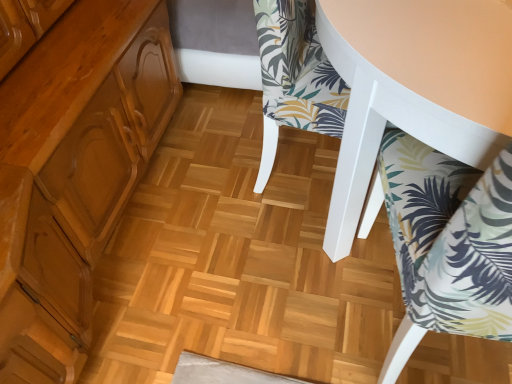
What is the approximate width of white fabric chair at upper right, which is counted as the second chair, starting from the bottom?

22.88 inches.

This screenshot has width=512, height=384. Identify the location of white fabric chair at upper right, the 1th chair viewed from the top. (415, 87).

In order to face white fabric chair at upper right, the 1th chair viewed from the top, should I rotate leftwards or rightwards?

Rotate your view right by about 12.801°.

Describe the element at coordinates (415, 87) in the screenshot. The height and width of the screenshot is (384, 512). I see `white fabric chair at upper right, the 1th chair viewed from the top` at that location.

The width and height of the screenshot is (512, 384). Describe the element at coordinates (450, 237) in the screenshot. I see `printed fabric chair at lower right, which ranks as the 1th chair in bottom-to-top order` at that location.

You are a GUI agent. You are given a task and a screenshot of the screen. Output one action in this format:
    pyautogui.click(x=<x>, y=<y>)
    Task: Click on the printed fabric chair at lower right, which ranks as the 1th chair in bottom-to-top order
    This screenshot has height=384, width=512.
    Given the screenshot: What is the action you would take?
    pyautogui.click(x=450, y=237)

Identify the location of white fabric chair at upper right, the 1th chair viewed from the top. (415, 87).

Based on their positions, is white fabric chair at upper right, the 1th chair viewed from the top, located to the left or right of printed fabric chair at lower right, which appears as the 2th chair when viewed from the top?

Based on their positions, white fabric chair at upper right, the 1th chair viewed from the top, is located to the left of printed fabric chair at lower right, which appears as the 2th chair when viewed from the top.

Is white fabric chair at upper right, which is counted as the second chair, starting from the bottom, further to camera compared to printed fabric chair at lower right, which ranks as the 1th chair in bottom-to-top order?

Yes.

Between point (387, 18) and point (452, 297), which one is positioned in front?

Positioned in front is point (452, 297).

From the image's perspective, which object appears higher, white fabric chair at upper right, the 1th chair viewed from the top, or printed fabric chair at lower right, which appears as the 2th chair when viewed from the top?

white fabric chair at upper right, the 1th chair viewed from the top.

From a real-world perspective, does white fabric chair at upper right, the 1th chair viewed from the top, sit lower than printed fabric chair at lower right, which ranks as the 1th chair in bottom-to-top order?

Yes, from a real-world perspective, white fabric chair at upper right, the 1th chair viewed from the top, is below printed fabric chair at lower right, which ranks as the 1th chair in bottom-to-top order.

Considering the relative sizes of white fabric chair at upper right, the 1th chair viewed from the top, and printed fabric chair at lower right, which appears as the 2th chair when viewed from the top, in the image provided, is white fabric chair at upper right, the 1th chair viewed from the top, thinner than printed fabric chair at lower right, which appears as the 2th chair when viewed from the top,?

No, white fabric chair at upper right, the 1th chair viewed from the top, is not thinner than printed fabric chair at lower right, which appears as the 2th chair when viewed from the top.

Considering the sizes of objects white fabric chair at upper right, the 1th chair viewed from the top, and printed fabric chair at lower right, which ranks as the 1th chair in bottom-to-top order, in the image provided, who is shorter, white fabric chair at upper right, the 1th chair viewed from the top, or printed fabric chair at lower right, which ranks as the 1th chair in bottom-to-top order,?

white fabric chair at upper right, the 1th chair viewed from the top.

Who is smaller, white fabric chair at upper right, which is counted as the second chair, starting from the bottom, or printed fabric chair at lower right, which appears as the 2th chair when viewed from the top?

printed fabric chair at lower right, which appears as the 2th chair when viewed from the top, is smaller.

From the picture: Is white fabric chair at upper right, the 1th chair viewed from the top, inside the boundaries of printed fabric chair at lower right, which ranks as the 1th chair in bottom-to-top order, or outside?

white fabric chair at upper right, the 1th chair viewed from the top, lies outside printed fabric chair at lower right, which ranks as the 1th chair in bottom-to-top order.

Is there a large distance between white fabric chair at upper right, which is counted as the second chair, starting from the bottom, and printed fabric chair at lower right, which appears as the 2th chair when viewed from the top?

No, white fabric chair at upper right, which is counted as the second chair, starting from the bottom, is not far from printed fabric chair at lower right, which appears as the 2th chair when viewed from the top.

Is white fabric chair at upper right, the 1th chair viewed from the top, facing towards printed fabric chair at lower right, which appears as the 2th chair when viewed from the top?

No, white fabric chair at upper right, the 1th chair viewed from the top, is not aimed at printed fabric chair at lower right, which appears as the 2th chair when viewed from the top.

What's the angular difference between white fabric chair at upper right, which is counted as the second chair, starting from the bottom, and printed fabric chair at lower right, which ranks as the 1th chair in bottom-to-top order,'s facing directions?

The facing directions of white fabric chair at upper right, which is counted as the second chair, starting from the bottom, and printed fabric chair at lower right, which ranks as the 1th chair in bottom-to-top order, are 101 degrees apart.

You are a GUI agent. You are given a task and a screenshot of the screen. Output one action in this format:
    pyautogui.click(x=<x>, y=<y>)
    Task: Click on the chair above the printed fabric chair at lower right, which appears as the 2th chair when viewed from the top (from the image's perspective)
    
    Given the screenshot: What is the action you would take?
    pyautogui.click(x=415, y=87)

In the image, is printed fabric chair at lower right, which appears as the 2th chair when viewed from the top, on the left side or the right side of white fabric chair at upper right, the 1th chair viewed from the top?

Based on their positions, printed fabric chair at lower right, which appears as the 2th chair when viewed from the top, is located to the right of white fabric chair at upper right, the 1th chair viewed from the top.

In the image, is printed fabric chair at lower right, which ranks as the 1th chair in bottom-to-top order, positioned in front of or behind white fabric chair at upper right, which is counted as the second chair, starting from the bottom?

In the image, printed fabric chair at lower right, which ranks as the 1th chair in bottom-to-top order, appears in front of white fabric chair at upper right, which is counted as the second chair, starting from the bottom.

Which is nearer, [490,219] or [375,148]?

Clearly, point [490,219] is closer to the camera than point [375,148].

From the image's perspective, which one is positioned lower, printed fabric chair at lower right, which appears as the 2th chair when viewed from the top, or white fabric chair at upper right, the 1th chair viewed from the top?

printed fabric chair at lower right, which appears as the 2th chair when viewed from the top, is shown below in the image.

From a real-world perspective, is printed fabric chair at lower right, which ranks as the 1th chair in bottom-to-top order, on top of white fabric chair at upper right, the 1th chair viewed from the top?

Yes.

Can you confirm if printed fabric chair at lower right, which ranks as the 1th chair in bottom-to-top order, is wider than white fabric chair at upper right, which is counted as the second chair, starting from the bottom?

No, printed fabric chair at lower right, which ranks as the 1th chair in bottom-to-top order, is not wider than white fabric chair at upper right, which is counted as the second chair, starting from the bottom.

Considering the sizes of objects printed fabric chair at lower right, which ranks as the 1th chair in bottom-to-top order, and white fabric chair at upper right, which is counted as the second chair, starting from the bottom, in the image provided, who is taller, printed fabric chair at lower right, which ranks as the 1th chair in bottom-to-top order, or white fabric chair at upper right, which is counted as the second chair, starting from the bottom,?

Standing taller between the two is printed fabric chair at lower right, which ranks as the 1th chair in bottom-to-top order.

Which of these two, printed fabric chair at lower right, which appears as the 2th chair when viewed from the top, or white fabric chair at upper right, the 1th chair viewed from the top, is bigger?

white fabric chair at upper right, the 1th chair viewed from the top.

Can we say printed fabric chair at lower right, which ranks as the 1th chair in bottom-to-top order, lies outside white fabric chair at upper right, which is counted as the second chair, starting from the bottom?

That's correct, printed fabric chair at lower right, which ranks as the 1th chair in bottom-to-top order, is outside of white fabric chair at upper right, which is counted as the second chair, starting from the bottom.

Is printed fabric chair at lower right, which appears as the 2th chair when viewed from the top, in contact with white fabric chair at upper right, the 1th chair viewed from the top?

No, printed fabric chair at lower right, which appears as the 2th chair when viewed from the top, is not in contact with white fabric chair at upper right, the 1th chair viewed from the top.

Could you tell me if printed fabric chair at lower right, which appears as the 2th chair when viewed from the top, is facing white fabric chair at upper right, which is counted as the second chair, starting from the bottom?

Yes, printed fabric chair at lower right, which appears as the 2th chair when viewed from the top, faces towards white fabric chair at upper right, which is counted as the second chair, starting from the bottom.

Measure the distance from printed fabric chair at lower right, which appears as the 2th chair when viewed from the top, to white fabric chair at upper right, which is counted as the second chair, starting from the bottom.

printed fabric chair at lower right, which appears as the 2th chair when viewed from the top, and white fabric chair at upper right, which is counted as the second chair, starting from the bottom, are 18.67 centimeters apart.

Where is `chair in front of the white fabric chair at upper right, which is counted as the second chair, starting from the bottom`? The width and height of the screenshot is (512, 384). chair in front of the white fabric chair at upper right, which is counted as the second chair, starting from the bottom is located at coordinates (450, 237).

There is a white fabric chair at upper right, the 1th chair viewed from the top. Identify the location of chair above it (from a real-world perspective). The image size is (512, 384). click(x=450, y=237).

This screenshot has height=384, width=512. In order to click on chair in front of the white fabric chair at upper right, which is counted as the second chair, starting from the bottom in this screenshot , I will do pyautogui.click(x=450, y=237).